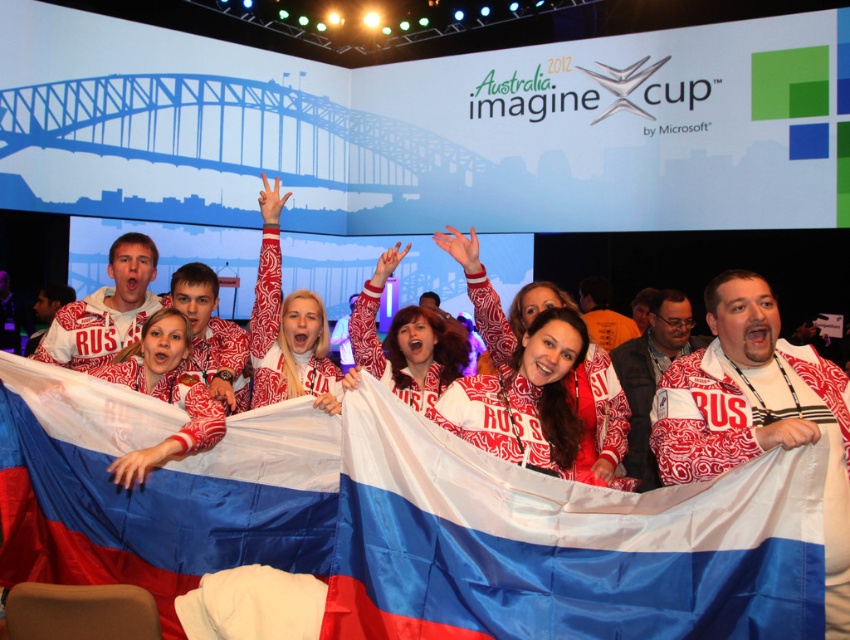
You are a photographer at the Microsoft Imagine Cup event in Sydney. You want to capture a photo of the polyester flag at center without including the Sydney Harbour Bridge in the background. Given the flag is 10.71 feet away from the camera, what is the minimum distance you need to move backward to ensure the bridge is out of frame?

The polyester flag at center is 10.71 feet from the camera. To ensure the Sydney Harbour Bridge is out of frame, you need to move the camera at least 10.71 feet backward so the flag remains in focus while the bridge becomes obscured.

Based on the photo, you are standing in front of the Sydney Harbour Bridge at the Microsoft Imagine Cup 2012 event. You notice two points marked in the scene. Which point, point 1 at coordinates (218, 490) or point 2 at coordinates (64, 336), is closer to you?

Point 1 at coordinates (218, 490) is closer to the viewer than point 2 at coordinates (64, 336).

You are organizing a photo shoot for a clothing brand and need to ensure that the two sweaters displayed in the image are appropriately sized for the models. Given that the white textured sweater at center is narrower than the white printed sweater at center, which sweater would require a model with a larger frame to maintain a proportional fit?

The white printed sweater at center requires a model with a larger frame because its width is greater than the white textured sweater at center.